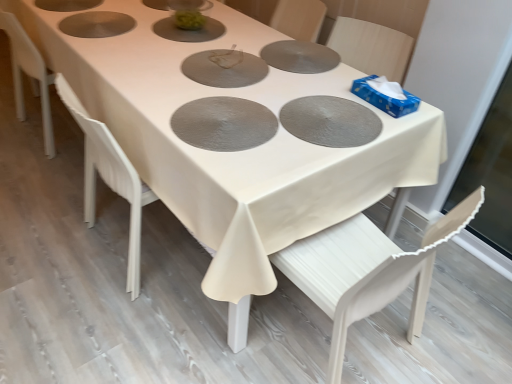
This screenshot has width=512, height=384. What are the coordinates of `free area in between matte gray pizza pan at center, which is the second pizza pan in bottom-to-top order, and matte gray pizza pan at center, which ranks as the 1th pizza pan in top-to-bottom order` in the screenshot? It's located at (280, 82).